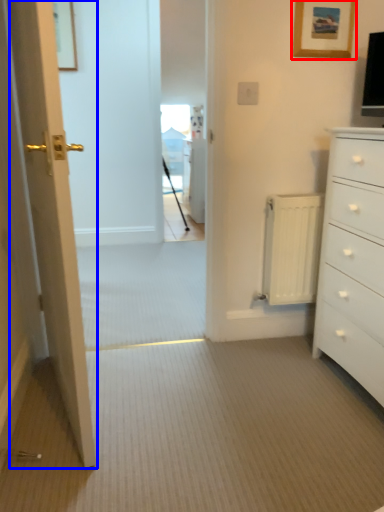
Question: Which object appears farthest to the camera in this image, picture frame (highlighted by a red box) or door (highlighted by a blue box)?

Choices:
 (A) picture frame
 (B) door

Answer: (A)